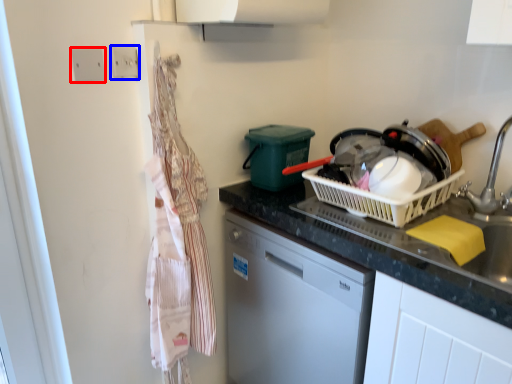
Question: Which object is further to the camera taking this photo, electric outlet (highlighted by a red box) or electric outlet (highlighted by a blue box)?

Choices:
 (A) electric outlet
 (B) electric outlet

Answer: (B)